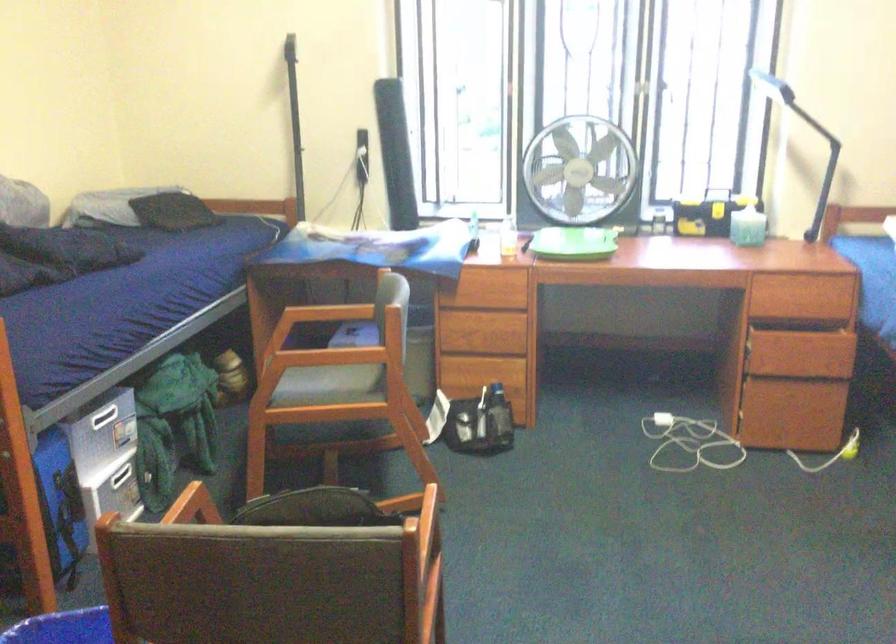
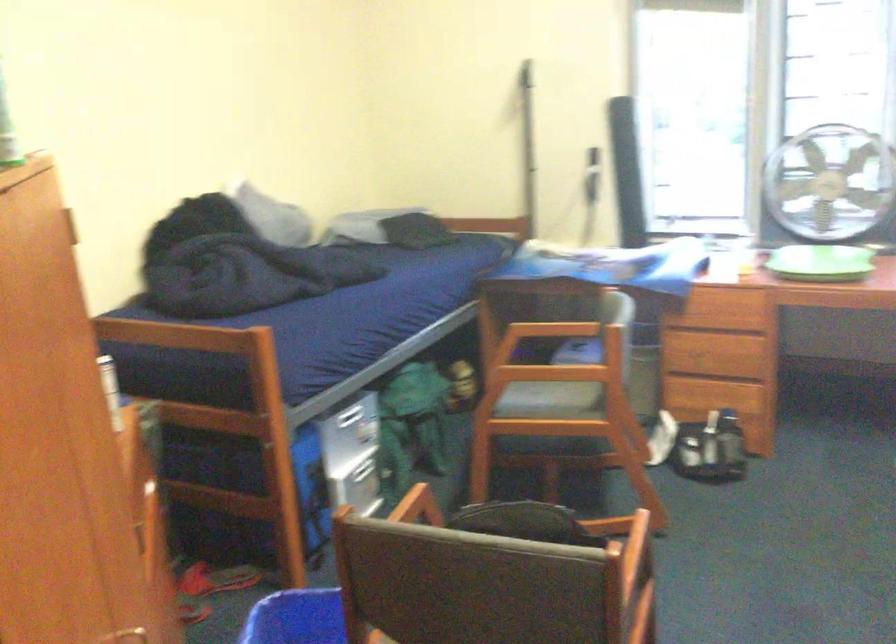
Question: How did the camera likely rotate?

Choices:
 (A) Left
 (B) Right
 (C) Up
 (D) Down

Answer: (A)